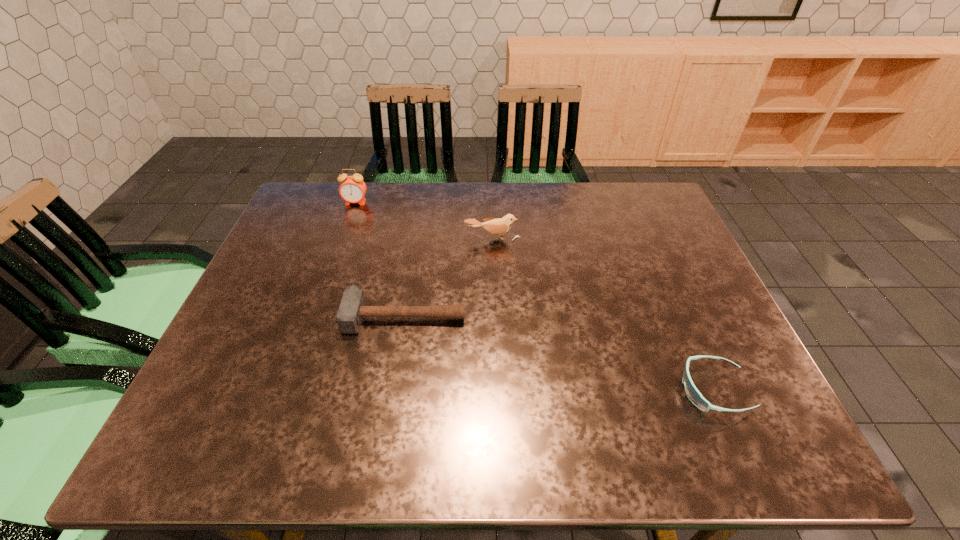
You are a GUI agent. You are given a task and a screenshot of the screen. Output one action in this format:
    pyautogui.click(x=<x>, y=<y>)
    Task: Click on the empty location between the hammer and the goggles
    
    Given the screenshot: What is the action you would take?
    pyautogui.click(x=559, y=353)

Find the location of `vacant space that's between the bird and the hammer`. vacant space that's between the bird and the hammer is located at coordinates (448, 276).

You are a GUI agent. You are given a task and a screenshot of the screen. Output one action in this format:
    pyautogui.click(x=<x>, y=<y>)
    Task: Click on the vacant region between the third farthest object and the third nearest object
    
    Given the screenshot: What is the action you would take?
    pyautogui.click(x=448, y=276)

This screenshot has height=540, width=960. Identify the location of vacant region between the leftmost object and the third farthest object. (380, 259).

Find the location of `free space between the goggles and the third nearest object`. free space between the goggles and the third nearest object is located at coordinates (603, 314).

Identify which object is the third nearest to the third farthest object. Please provide its 2D coordinates. Your answer should be formatted as a tuple, i.e. [(x, y)], where the tuple contains the x and y coordinates of a point satisfying the conditions above.

[(693, 394)]

At what (x,y) coordinates should I click in order to perform the action: click on the third closest object to the hammer. Please return your answer as a coordinate pair (x, y). This screenshot has height=540, width=960. Looking at the image, I should click on (693, 394).